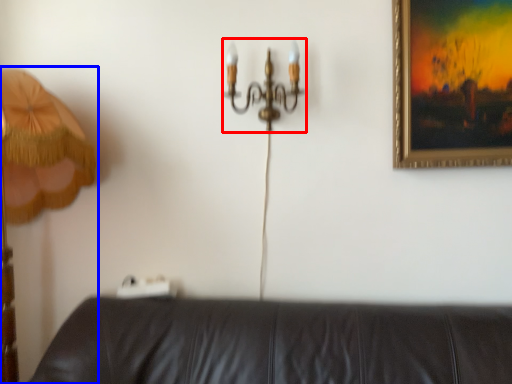
Question: Which of the following is the closest to the observer, chandelier (highlighted by a red box) or lamp (highlighted by a blue box)?

Choices:
 (A) chandelier
 (B) lamp

Answer: (B)